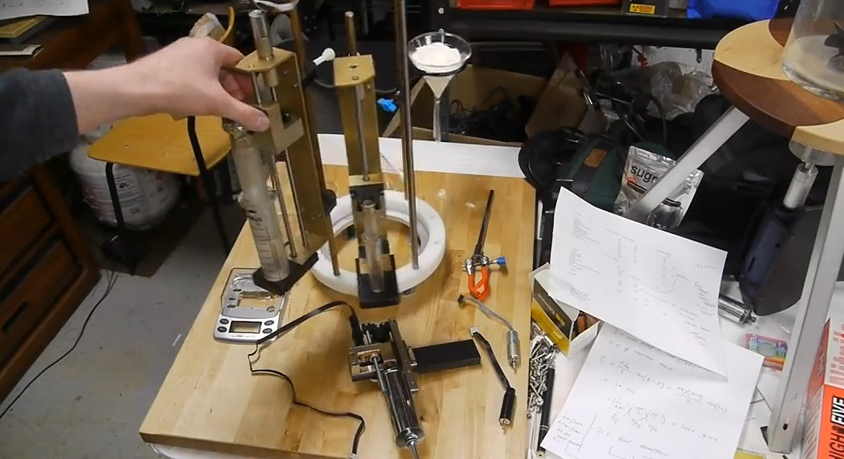
Locate an element on the screen. The height and width of the screenshot is (459, 844). black electrical cord running along the floor is located at coordinates (78, 339).